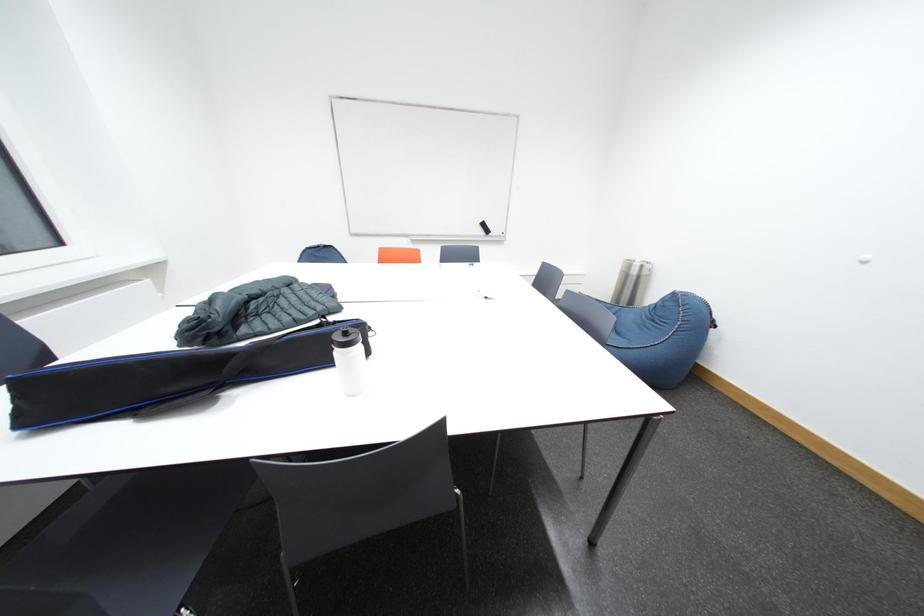
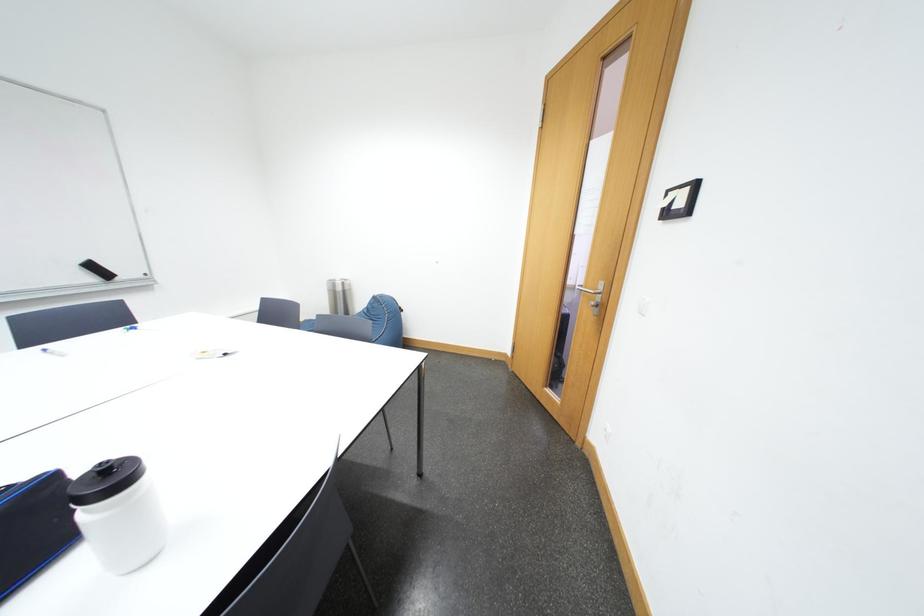
Question: The camera is either moving clockwise (left) or counter-clockwise (right) around the object. The first image is from the beginning of the video and the second image is from the end. Is the camera moving left or right when shooting the video?

Choices:
 (A) Left
 (B) Right

Answer: (A)